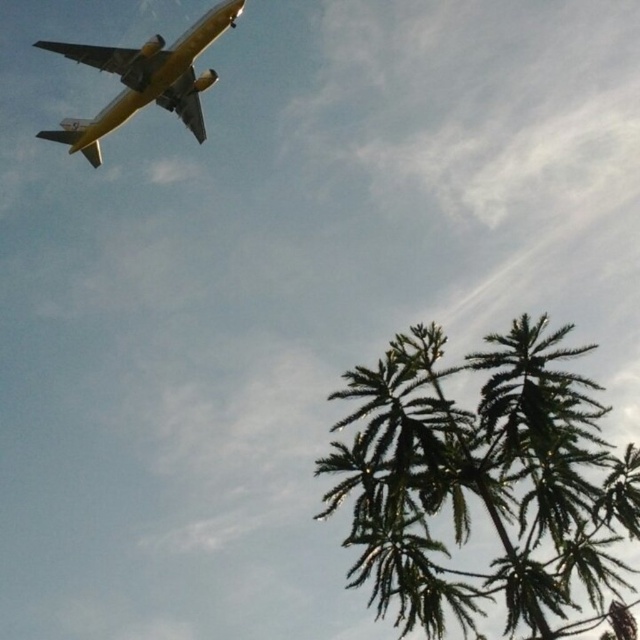
Between point (387, 541) and point (176, 90), which one is positioned in front?

Point (387, 541)

Based on the photo, between green textured palm tree at lower right and yellow matte airplane at upper left, which one has less height?

With less height is yellow matte airplane at upper left.

The width and height of the screenshot is (640, 640). What are the coordinates of `green textured palm tree at lower right` in the screenshot? It's located at (484, 486).